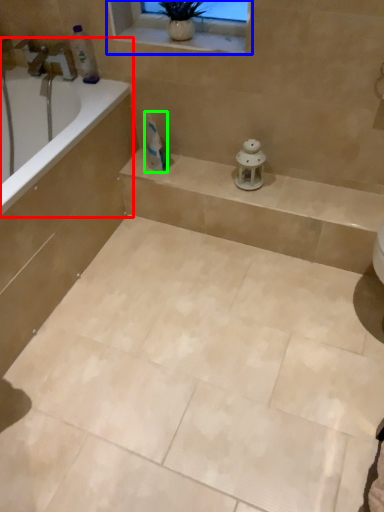
Question: Which object is positioned closest to bathtub (highlighted by a red box)? Select from window frame (highlighted by a blue box) and toothpaste (highlighted by a green box).

Choices:
 (A) window frame
 (B) toothpaste

Answer: (B)